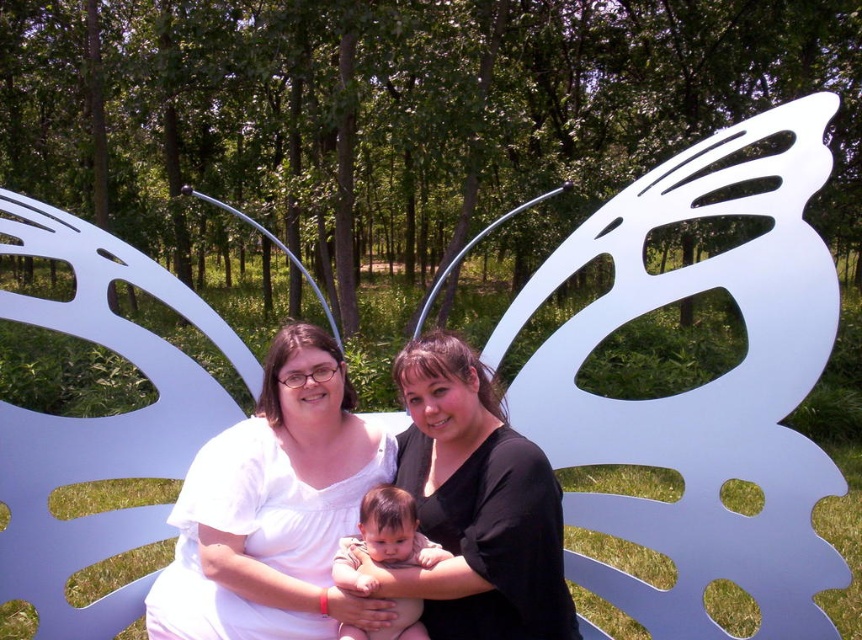
You are a photographer trying to capture the white matte shirt at center. You notice a point at coordinate (273, 508). Is the white matte shirt at center located at that point?

Yes, the white matte shirt at center is located at point (273, 508).

You are a photographer trying to capture a group photo of the two women on the butterfly bench. Since the white matte shirt at center and the black matte shirt at center are both in the center, which one should you adjust to ensure both shirts are equally visible in the photo?

Since the white matte shirt at center is wider than the black matte shirt at center, you should move the black matte shirt at center slightly to the side to balance their visibility in the photo.

You are a photographer trying to capture a closeup of the white matte shirt at center and the smooth skin baby at center. Since you want to focus on both subjects equally, which one should you position closer to the camera to ensure both are in sharp focus?

The white matte shirt at center is positioned on the left side of smooth skin baby at center. To have both in sharp focus, position the white matte shirt at center closer to the camera since it is already offset to the left, allowing the depth of field to cover both subjects effectively.